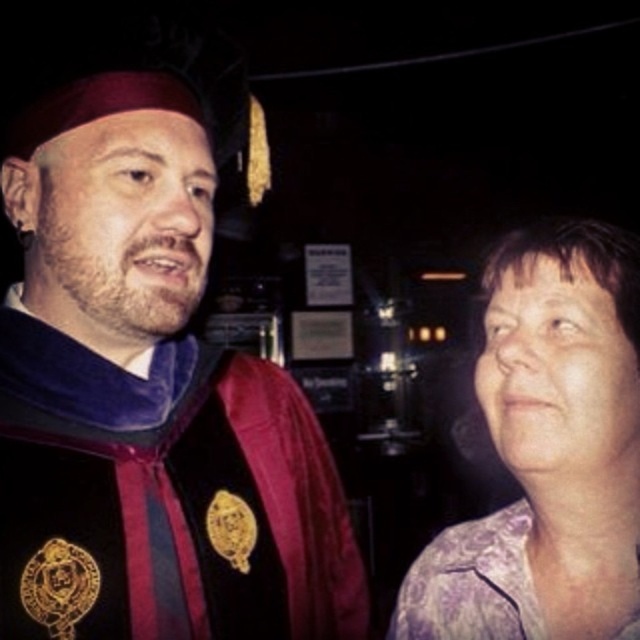
Question: Which of these objects is positioned closest to the velvet black graduation gown at left?

Choices:
 (A) purple textured blouse at right
 (B) purple satin blouse at right

Answer: (A)

Question: Which of the following is the farthest from the observer?

Choices:
 (A) purple textured blouse at right
 (B) purple satin blouse at right

Answer: (B)

Question: Is purple textured blouse at right further to the viewer compared to purple satin blouse at right?

Choices:
 (A) no
 (B) yes

Answer: (A)

Question: Does velvet black graduation gown at left appear over purple textured blouse at right?

Choices:
 (A) no
 (B) yes

Answer: (A)

Question: In this image, where is purple textured blouse at right located relative to purple satin blouse at right?

Choices:
 (A) right
 (B) left

Answer: (A)

Question: Which point is closer to the camera?

Choices:
 (A) purple textured blouse at right
 (B) purple satin blouse at right
 (C) velvet black graduation gown at left

Answer: (A)